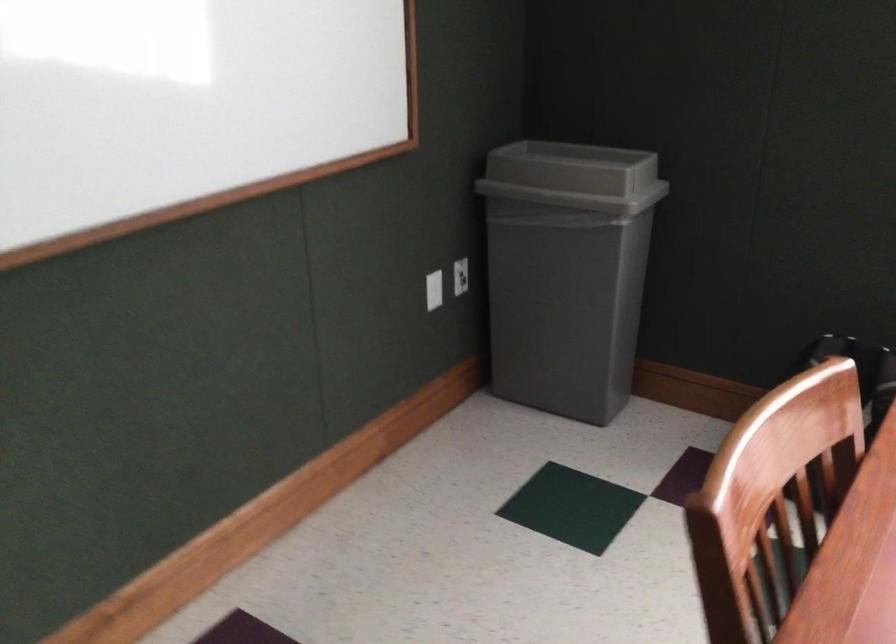
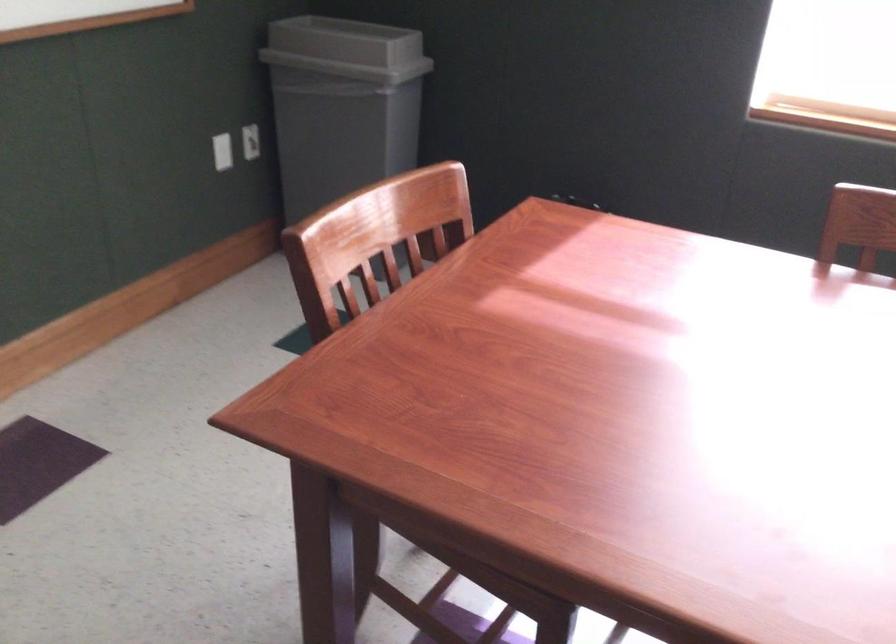
What movement of the cameraman would produce the second image?

The cameraman moved toward right, backward.